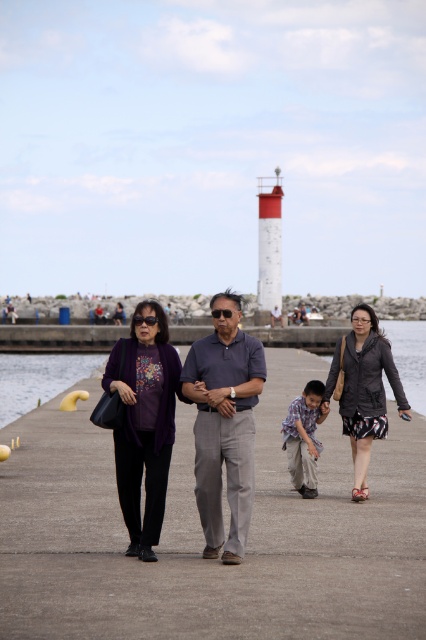
You are a photographer trying to capture a photo of the dark gray textured jacket at center and the light brown cotton shirt at center. Which one will appear larger in the photo?

The dark gray textured jacket at center will appear larger in the photo because it is taller than the light brown cotton shirt at center.

In the harbor scene, there are two people wearing a purple matte sweater at center and a light brown cotton shirt at center. Which one is located more to the left?

The purple matte sweater at center is more to the left than the light brown cotton shirt at center.